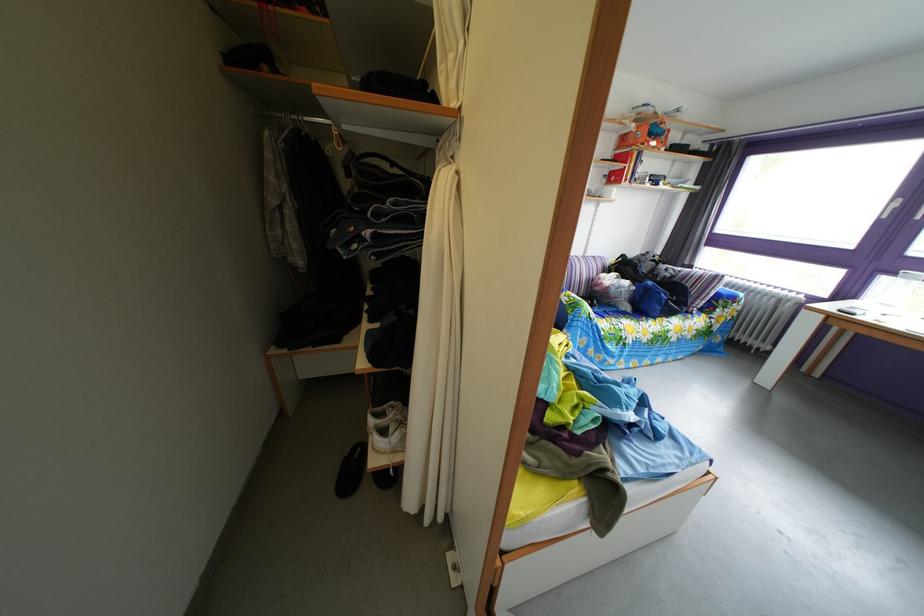
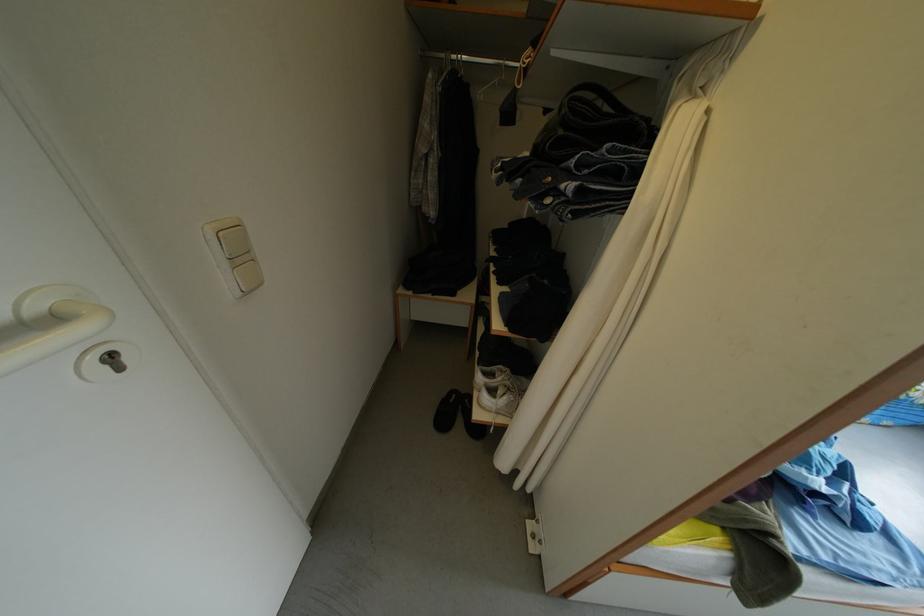
Find the pixel in the second image that matches point (359, 469) in the first image.

(456, 411)